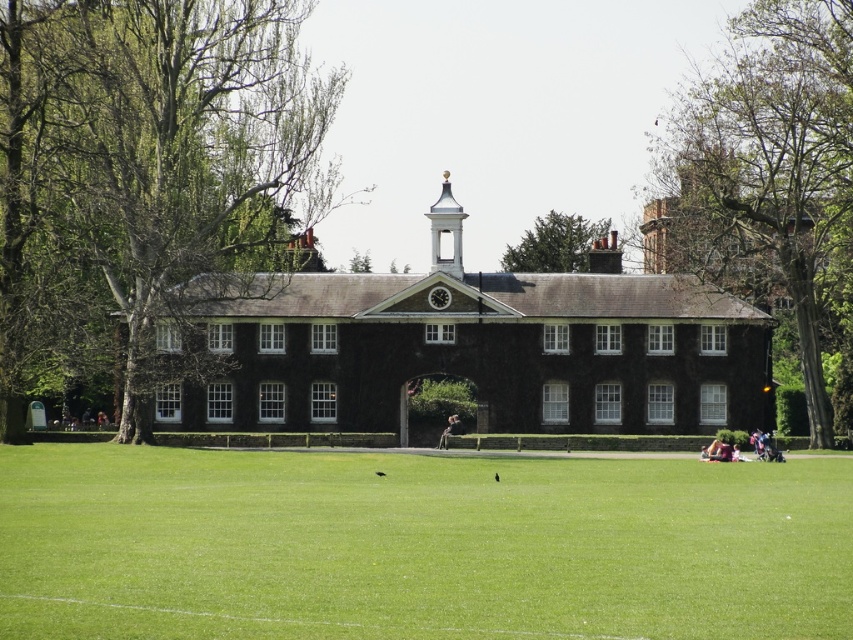
Is point (268, 625) closer to camera compared to point (196, 324)?

Yes, it is in front of point (196, 324).

Looking at this image, between green grass at center and green leafy tree at center, which one appears on the left side from the viewer's perspective?

From the viewer's perspective, green leafy tree at center appears more on the left side.

Does point (0, 552) lie in front of point (144, 220)?

Yes, point (0, 552) is in front of point (144, 220).

This screenshot has height=640, width=853. In order to click on green grass at center in this screenshot , I will do click(x=418, y=545).

Does green leafy tree at center have a greater height compared to light brown leather jacket at center?

Yes, green leafy tree at center is taller than light brown leather jacket at center.

How much distance is there between green leafy tree at center and light brown leather jacket at center?

The distance of green leafy tree at center from light brown leather jacket at center is 29.74 meters.

Is point (119, 276) in front of point (450, 428)?

No, (119, 276) is further to viewer.

Identify the location of green leafy tree at center. (148, 179).

Is point (152, 480) less distant than point (453, 416)?

Yes, it is.

Between point (796, 506) and point (460, 426), which one is positioned in front?

Point (796, 506) is more forward.

Where is `green grass at center`? green grass at center is located at coordinates (418, 545).